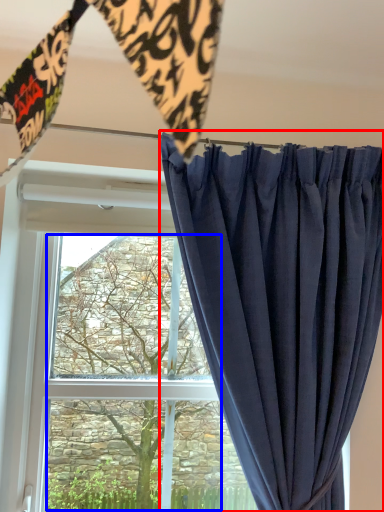
Question: Which of the following is the closest to the observer, curtain (highlighted by a red box) or tree (highlighted by a blue box)?

Choices:
 (A) curtain
 (B) tree

Answer: (A)